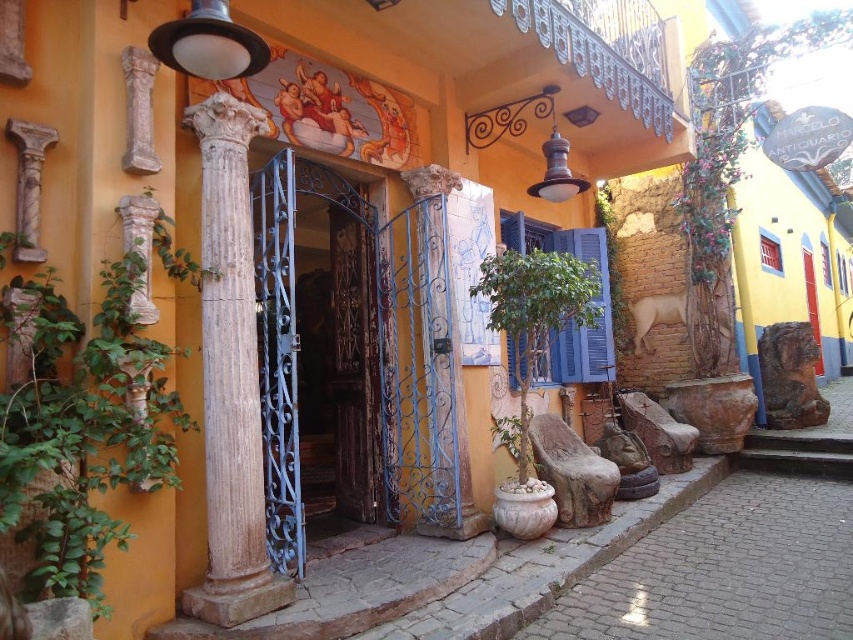
Does blue matte shutter at center have a greater height compared to wooden door at center?

In fact, blue matte shutter at center may be shorter than wooden door at center.

Is blue matte shutter at center to the left of wooden door at center from the viewer's perspective?

Indeed, blue matte shutter at center is positioned on the left side of wooden door at center.

The width and height of the screenshot is (853, 640). Identify the location of blue matte shutter at center. (595, 320).

Locate an element on the screen. Image resolution: width=853 pixels, height=640 pixels. blue matte shutter at center is located at coordinates (595, 320).

Does green leafy plant at left lie behind blue matte shutter at center?

No, green leafy plant at left is in front of blue matte shutter at center.

Does point (155, 449) come behind point (575, 241)?

That is False.

Find the location of a particular element. green leafy plant at left is located at coordinates (80, 426).

Is green leafy plant at left to the right of blue wrought iron gate at center from the viewer's perspective?

No, green leafy plant at left is not to the right of blue wrought iron gate at center.

What do you see at coordinates (80, 426) in the screenshot? I see `green leafy plant at left` at bounding box center [80, 426].

Measure the distance between green leafy plant at left and camera.

green leafy plant at left is 7.13 feet away from camera.

In order to click on green leafy plant at left in this screenshot , I will do `click(80, 426)`.